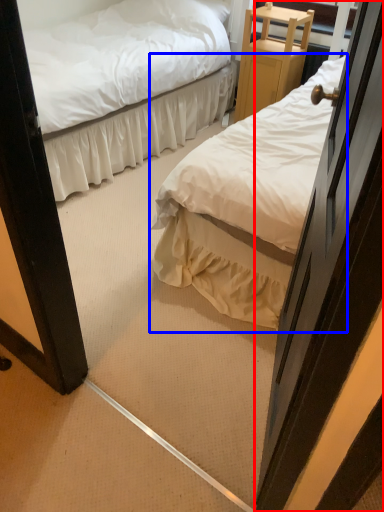
Question: Among these objects, which one is nearest to the camera, door (highlighted by a red box) or bed (highlighted by a blue box)?

Choices:
 (A) door
 (B) bed

Answer: (A)